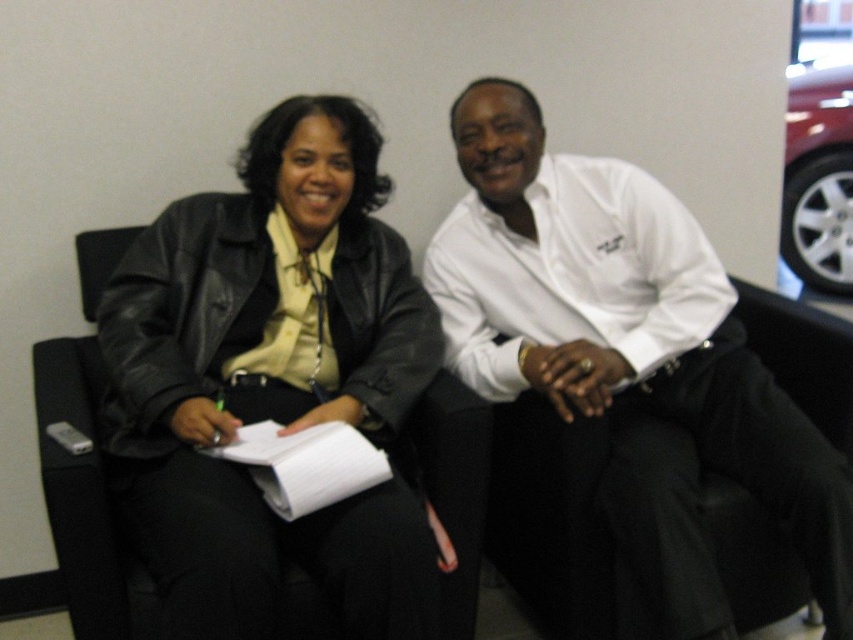
Between white shirt at center and shiny metallic car at upper right, which one has less height?

shiny metallic car at upper right is shorter.

Does white shirt at center appear on the left side of shiny metallic car at upper right?

Yes, white shirt at center is to the left of shiny metallic car at upper right.

This screenshot has width=853, height=640. What are the coordinates of `white shirt at center` in the screenshot? It's located at pos(625,360).

Is point (177, 269) in front of point (834, 77)?

Yes, point (177, 269) is closer to viewer.

Who is shorter, black leather jacket at left or shiny metallic car at upper right?

black leather jacket at left

This screenshot has height=640, width=853. Identify the location of black leather jacket at left. (271, 381).

Is black leather jacket at left further to camera compared to white shirt at center?

No.

Locate an element on the screen. The image size is (853, 640). black leather jacket at left is located at coordinates (271, 381).

You are a GUI agent. You are given a task and a screenshot of the screen. Output one action in this format:
    pyautogui.click(x=<x>, y=<y>)
    Task: Click on the black leather jacket at left
    The width and height of the screenshot is (853, 640).
    Given the screenshot: What is the action you would take?
    pyautogui.click(x=271, y=381)